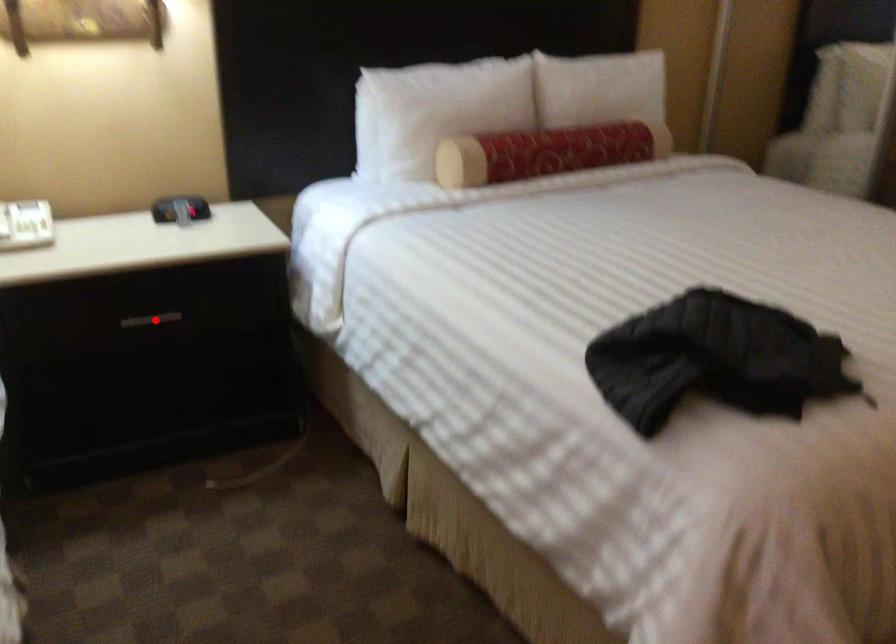
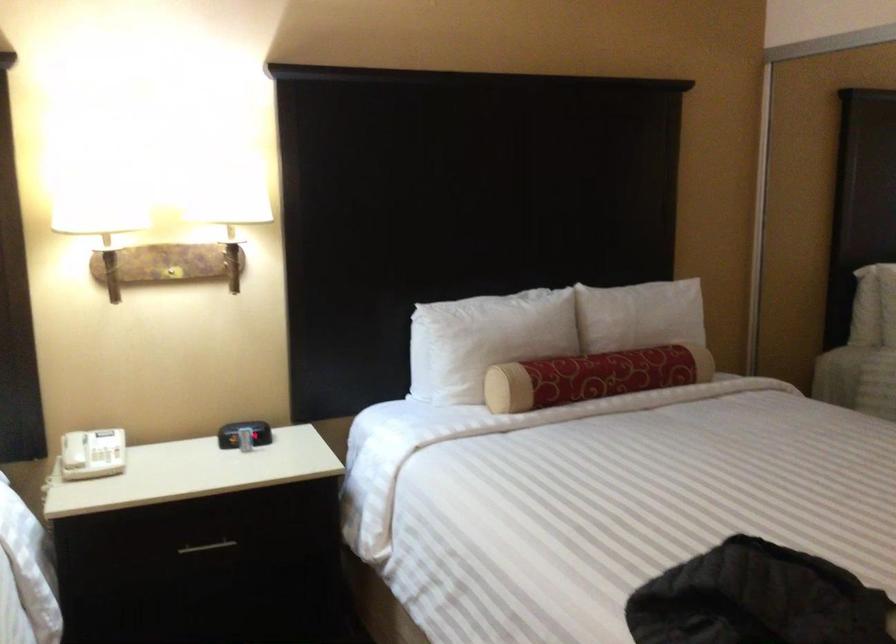
Locate, in the second image, the point that corresponds to the highlighted location in the first image.

(207, 547)